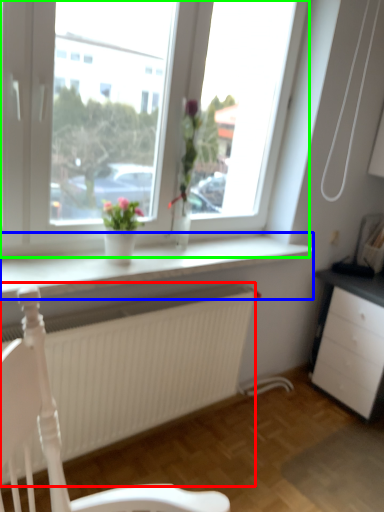
Question: Which object is the farthest from carpets (highlighted by a red box)? Choose among these: window sill (highlighted by a blue box) or window (highlighted by a green box).

Choices:
 (A) window sill
 (B) window

Answer: (B)